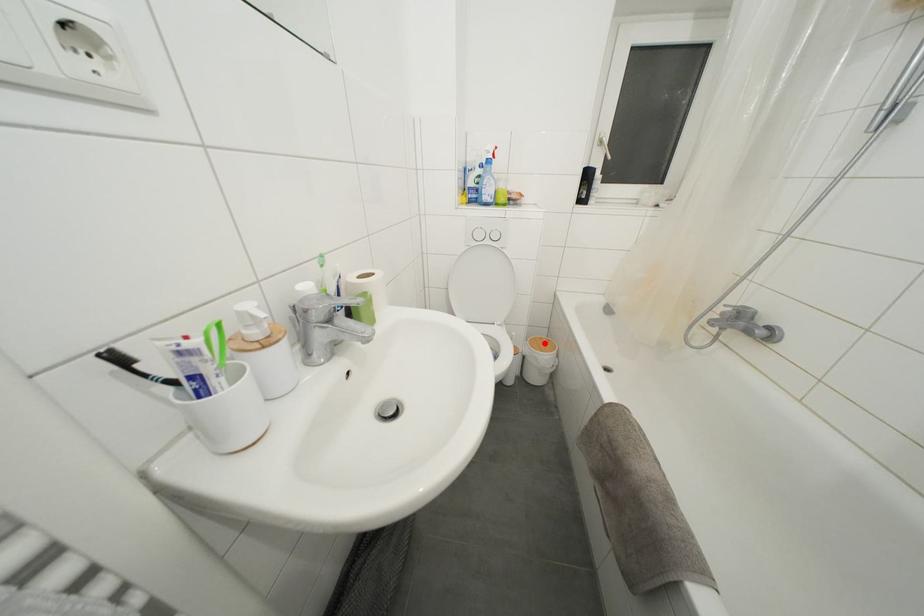
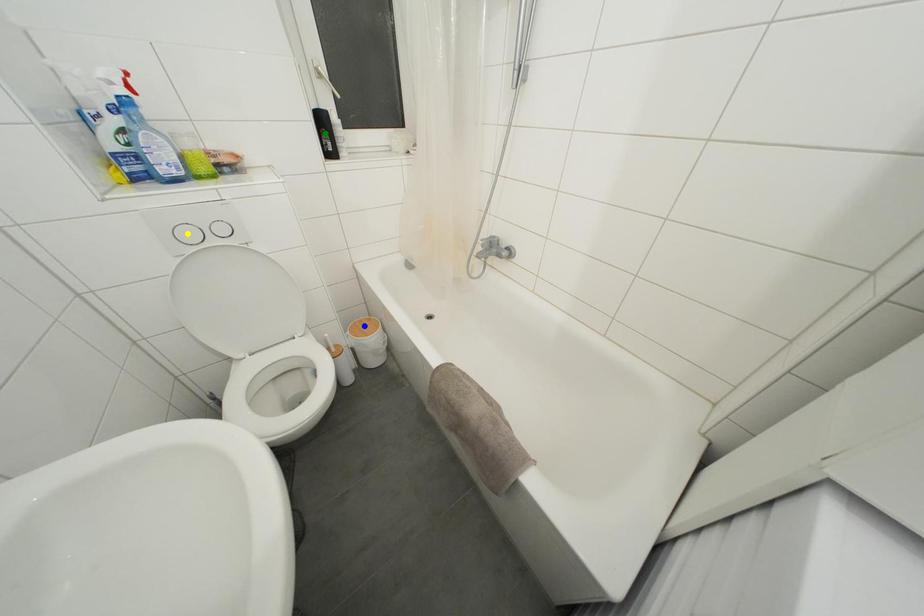
Question: I am providing you with two images of the same scene from different viewpoints. A red point is marked on the first image. You are given multiple points on the second image. In image 2, which mark is for the same physical point as the one in image 1?

Choices:
 (A) blue point
 (B) yellow point
 (C) green point

Answer: (A)